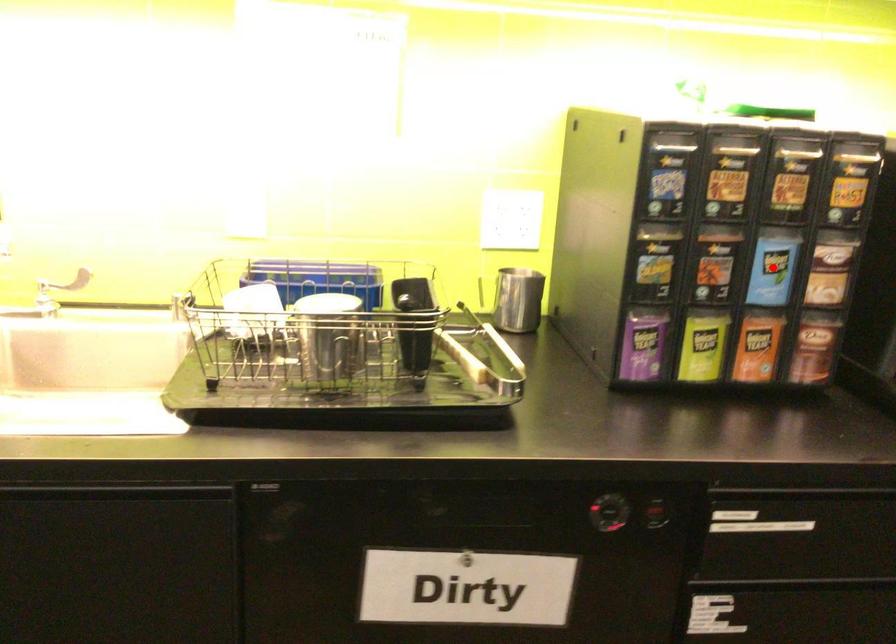
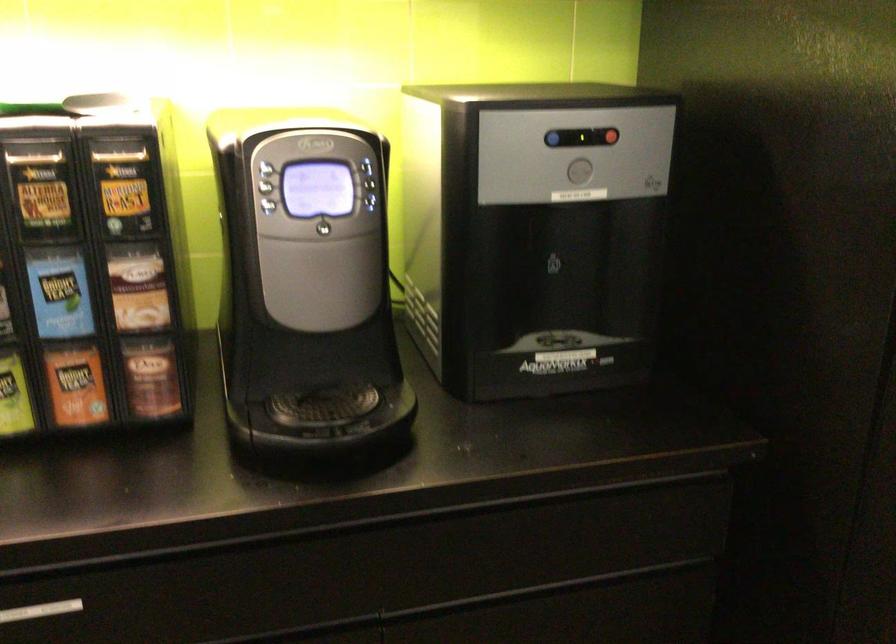
Question: I am providing you with two images of the same scene from different viewpoints. Given a red point in image1, look at the same physical point in image2. Is it:

Choices:
 (A) Closer to the viewpoint
 (B) Farther from the viewpoint

Answer: (A)